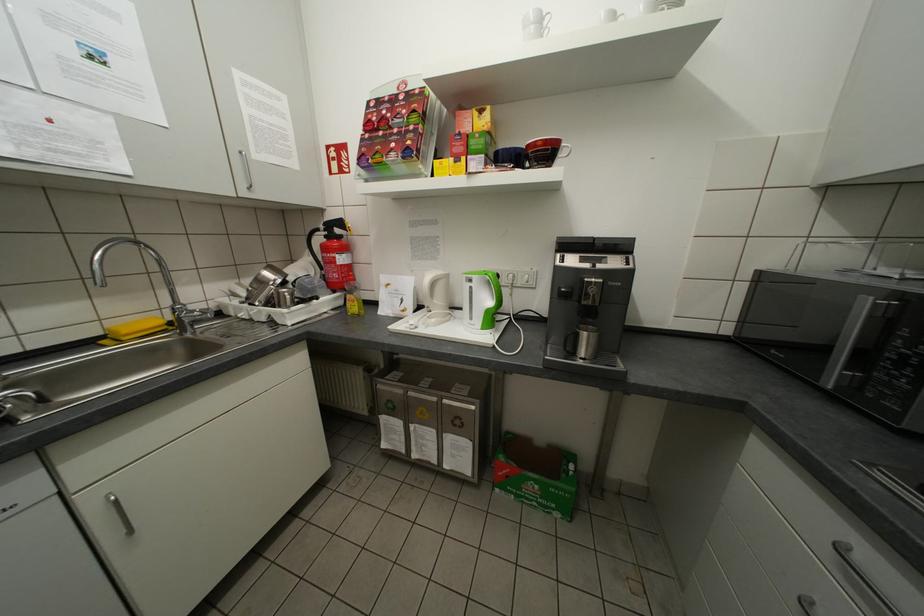
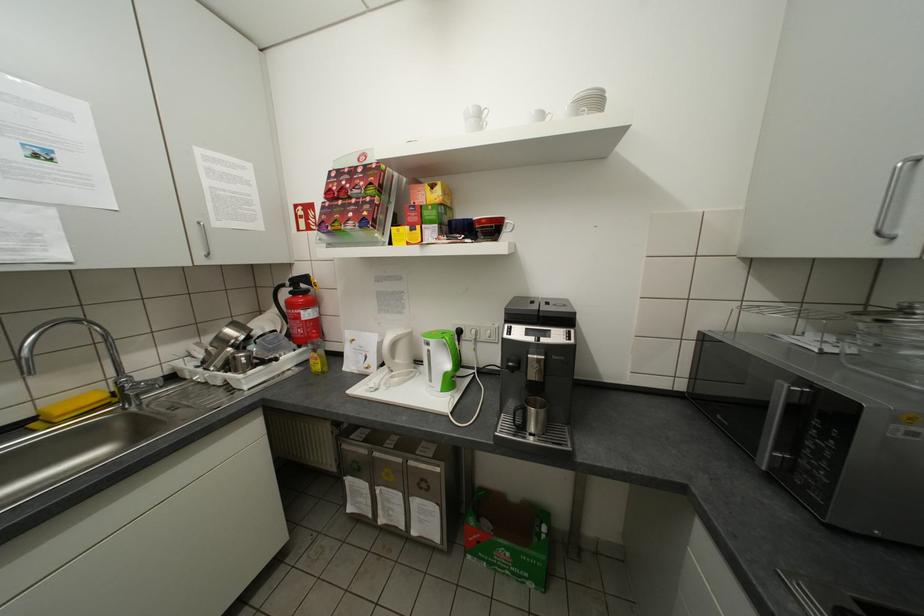
Find the pixel in the second image that matches (x=494, y=274) in the first image.

(452, 338)